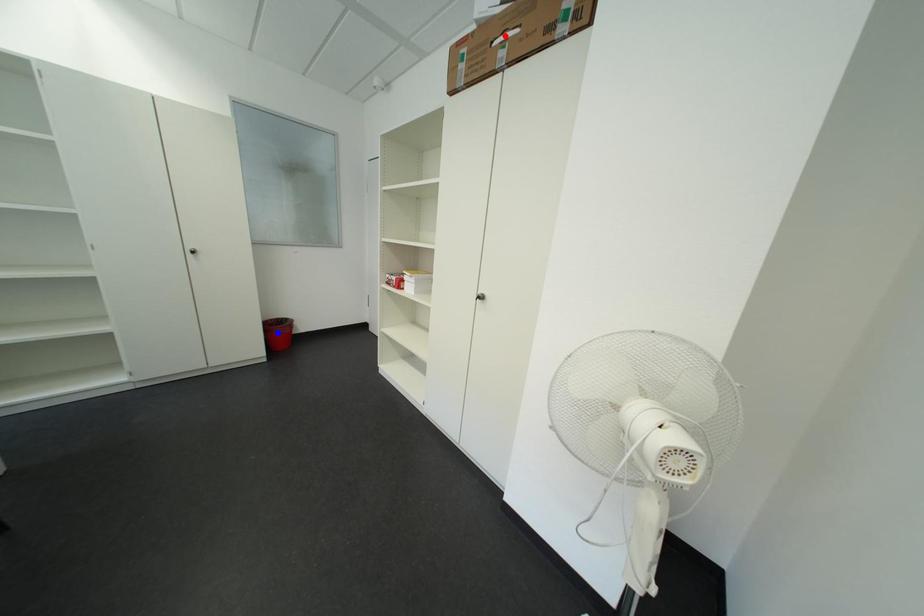
Question: In the image, two points are highlighted. Which point is nearer to the camera? Reply with the corresponding letter.

Choices:
 (A) blue point
 (B) red point

Answer: (B)